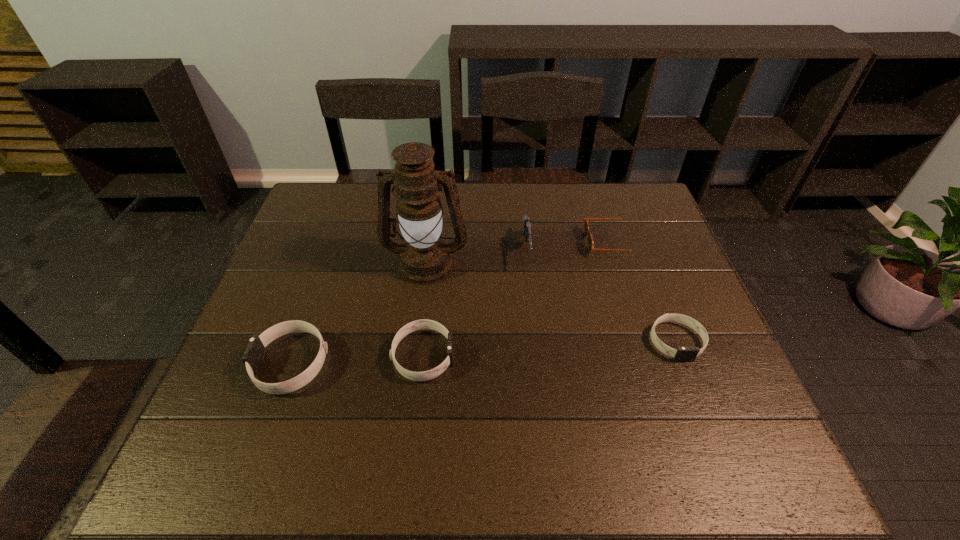
Where is `blank region between the second wristband from right to left and the fifth shortest object`? The image size is (960, 540). blank region between the second wristband from right to left and the fifth shortest object is located at coordinates (475, 303).

Identify the location of vacant region between the oil lamp and the third object from right to left. Image resolution: width=960 pixels, height=540 pixels. (476, 257).

I want to click on vacant area that lies between the tallest object and the second tallest object, so click(x=476, y=257).

The image size is (960, 540). I want to click on blank region between the leftmost wristband and the shortest wristband, so click(x=484, y=353).

Identify the location of empty location between the third object from right to left and the sunglasses. Image resolution: width=960 pixels, height=540 pixels. (568, 247).

At what (x,y) coordinates should I click in order to perform the action: click on free space between the second wristband from left to right and the sunglasses. Please return your answer as a coordinate pair (x, y). This screenshot has height=540, width=960. Looking at the image, I should click on (516, 299).

What are the coordinates of `the closest object to the leftmost wristband` in the screenshot? It's located at (416, 325).

Point out which object is positioned as the second nearest to the second wristband from right to left. Please provide its 2D coordinates. Your answer should be formatted as a tuple, i.e. [(x, y)], where the tuple contains the x and y coordinates of a point satisfying the conditions above.

[(425, 258)]

Identify which wristband is located as the second nearest to the sunglasses. Please provide its 2D coordinates. Your answer should be formatted as a tuple, i.e. [(x, y)], where the tuple contains the x and y coordinates of a point satisfying the conditions above.

[(416, 325)]

Select which wristband appears as the closest to the sunglasses. Please provide its 2D coordinates. Your answer should be formatted as a tuple, i.e. [(x, y)], where the tuple contains the x and y coordinates of a point satisfying the conditions above.

[(682, 354)]